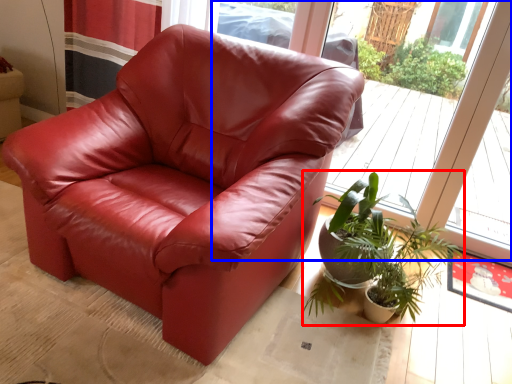
Question: Which of the following is the farthest to the observer, houseplant (highlighted by a red box) or window (highlighted by a blue box)?

Choices:
 (A) houseplant
 (B) window

Answer: (B)